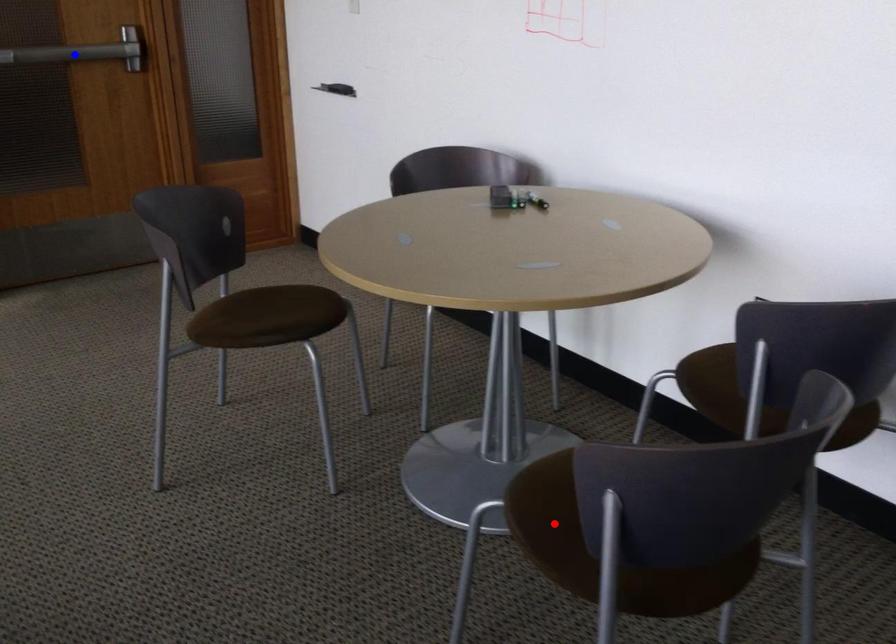
Question: In the image, two points are highlighted. Which point is nearer to the camera? Reply with the corresponding letter.

Choices:
 (A) blue point
 (B) red point

Answer: (B)